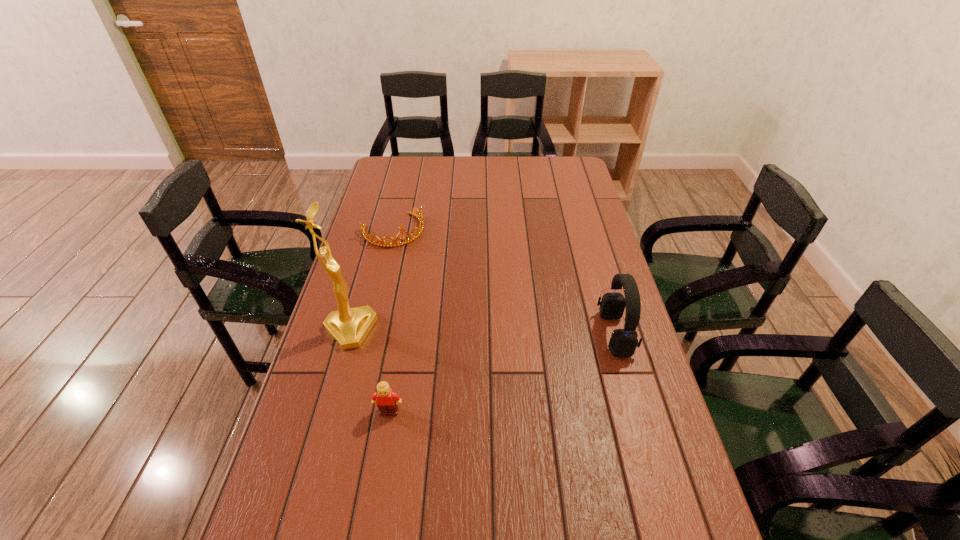
Locate an element on the screen. vacant area situated 0.360m on the headband of the headset is located at coordinates (477, 334).

Where is `free region located 0.100m on the front-facing side of the award`? free region located 0.100m on the front-facing side of the award is located at coordinates (406, 341).

Image resolution: width=960 pixels, height=540 pixels. In order to click on free space located 0.280m on the front-facing side of the award in this screenshot , I will do `click(467, 352)`.

Where is `free point located on the front-facing side of the award`? This screenshot has width=960, height=540. free point located on the front-facing side of the award is located at coordinates (390, 338).

Where is `vacant space located on the front-facing side of the farthest object`? This screenshot has width=960, height=540. vacant space located on the front-facing side of the farthest object is located at coordinates (438, 299).

Where is `blank space located on the front-facing side of the farthest object`? This screenshot has height=540, width=960. blank space located on the front-facing side of the farthest object is located at coordinates (417, 266).

The image size is (960, 540). I want to click on vacant region located 0.180m on the front-facing side of the farthest object, so click(423, 276).

I want to click on award that is at the left edge, so click(x=348, y=326).

Locate an element on the screen. This screenshot has width=960, height=540. tiara present at the left edge is located at coordinates (383, 243).

Locate an element on the screen. The height and width of the screenshot is (540, 960). object that is at the right edge is located at coordinates (623, 342).